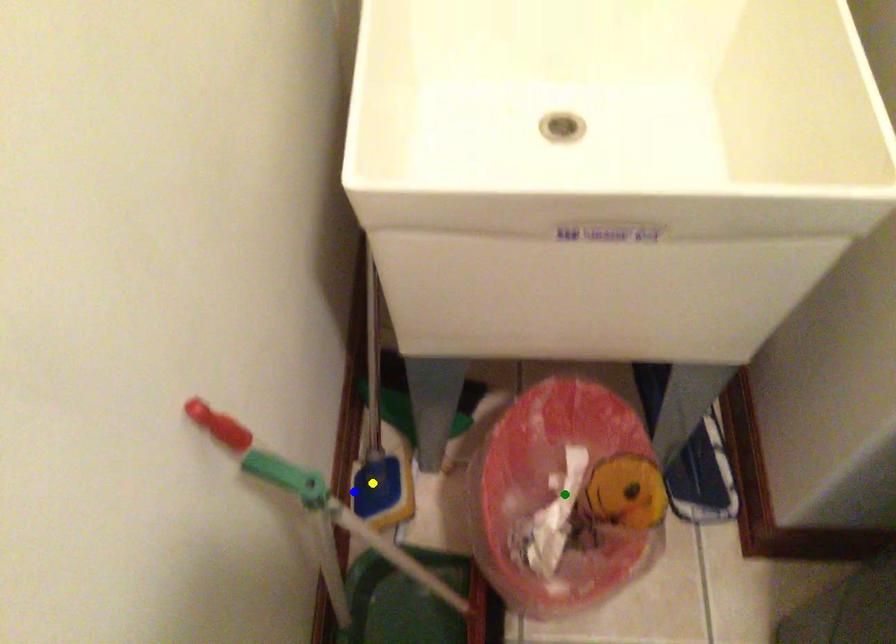
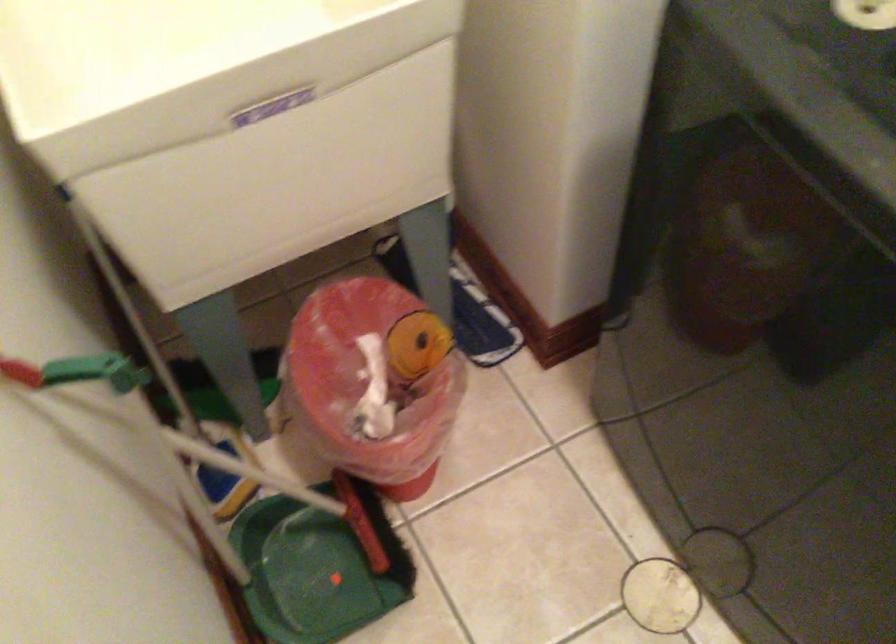
I am providing you with two images of the same scene from different viewpoints. Three points are marked in image1. Which point corresponds to a part or object that is occluded in image2?In image1, three points are marked. Which of them correspond to a part or object that is occluded in image2?Among the three points shown in image1, which one corresponds to a part or object that is no longer visible due to occlusion in image2?

Invisible in image2: yellow point.